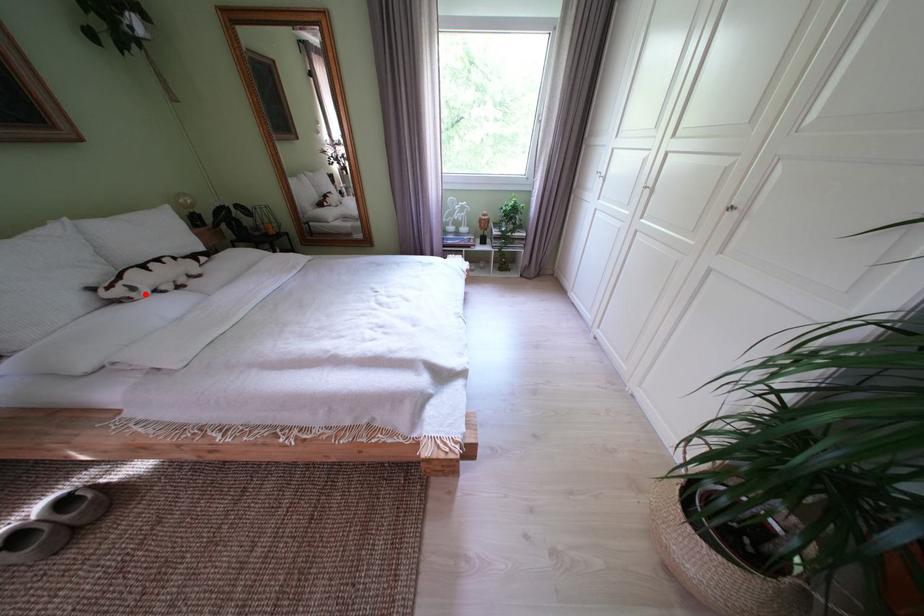
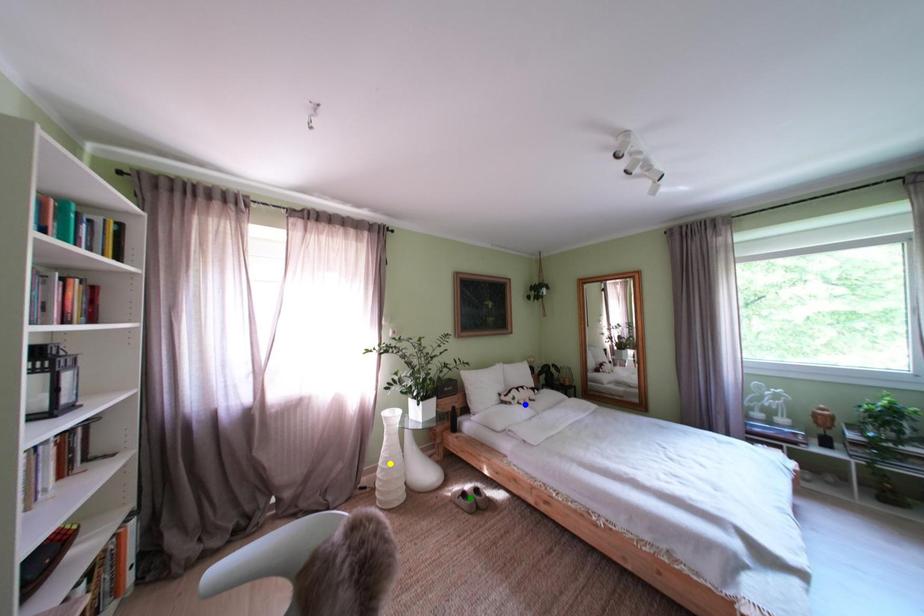
Question: I am providing you with two images of the same scene from different viewpoints. A red point is marked on the first image. You are given multiple points on the second image. Which point in image 2 represents the same 3d spot as the red point in image 1?

Choices:
 (A) yellow point
 (B) green point
 (C) blue point

Answer: (C)